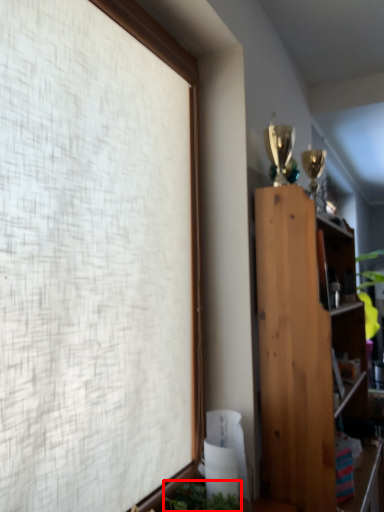
Question: From the image's perspective, considering the relative positions of plant (annotated by the red box) and bookcase in the image provided, where is plant (annotated by the red box) located with respect to the staircase?

Choices:
 (A) below
 (B) above

Answer: (A)